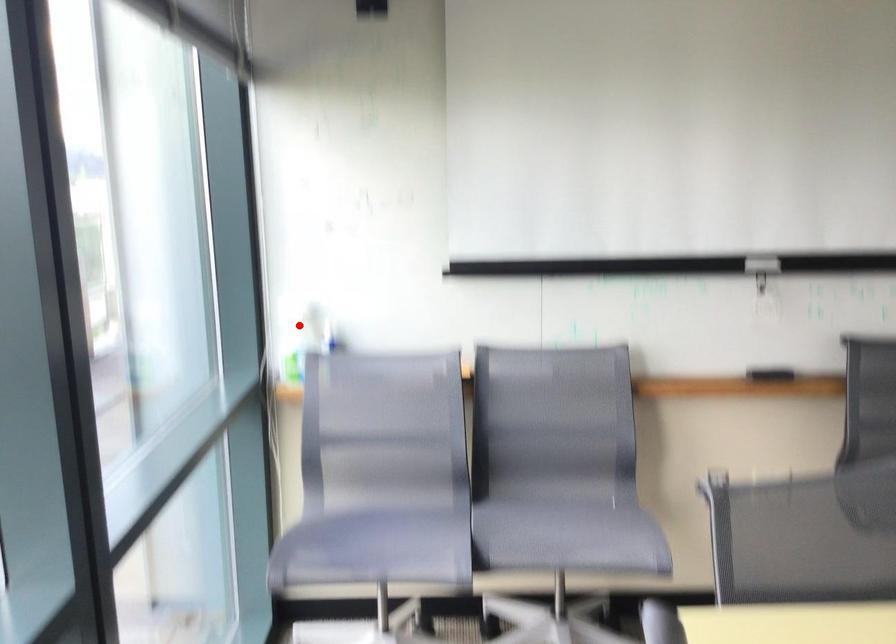
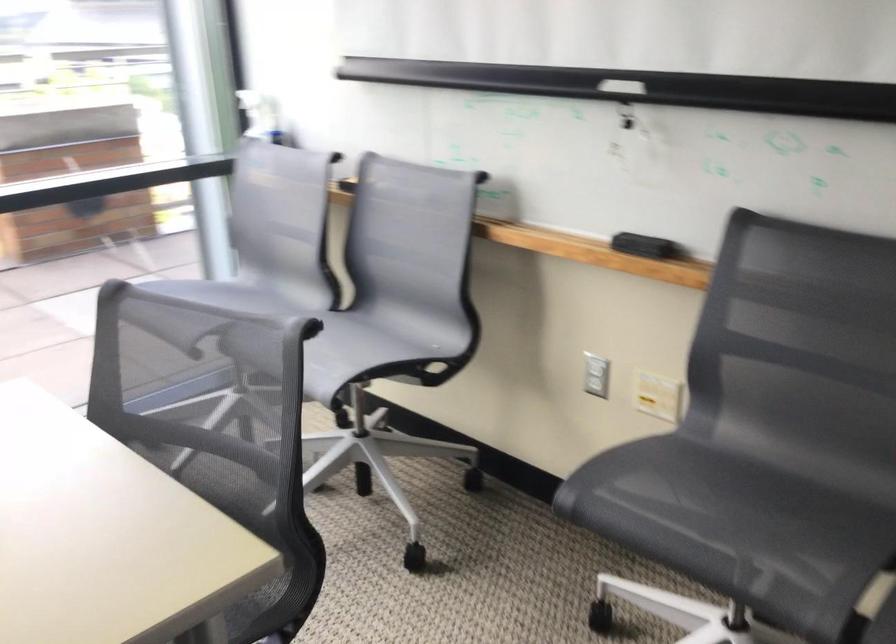
The point at the highlighted location is marked in the first image. Where is the corresponding point in the second image?

(260, 116)